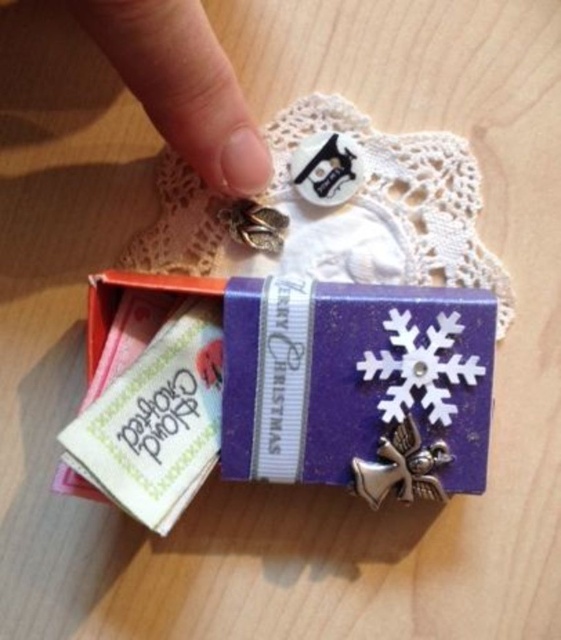
Question: Which object is positioned closest to the purple shiny gift box at center?

Choices:
 (A) white matte snowflake at center
 (B) nail polish at upper center

Answer: (A)

Question: Based on their relative distances, which object is nearer to the purple shiny gift box at center?

Choices:
 (A) nail polish at upper center
 (B) white matte snowflake at center

Answer: (B)

Question: Is the position of nail polish at upper center less distant than that of white matte snowflake at center?

Choices:
 (A) yes
 (B) no

Answer: (A)

Question: Is purple shiny gift box at center positioned in front of white matte snowflake at center?

Choices:
 (A) no
 (B) yes

Answer: (B)

Question: Can you confirm if nail polish at upper center is wider than white matte snowflake at center?

Choices:
 (A) no
 (B) yes

Answer: (B)

Question: Among these objects, which one is farthest from the camera?

Choices:
 (A) white matte snowflake at center
 (B) nail polish at upper center

Answer: (A)